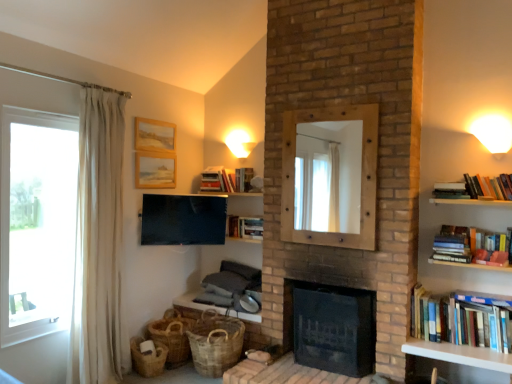
Question: Considering the relative sizes of wooden picture frame at upper center, the first picture frame ordered from the bottom, and wooden picture frame at upper center, the second picture frame ordered from the bottom, in the image provided, is wooden picture frame at upper center, the first picture frame ordered from the bottom, taller than wooden picture frame at upper center, the second picture frame ordered from the bottom,?

Choices:
 (A) no
 (B) yes

Answer: (B)

Question: Is wooden picture frame at upper center, acting as the second picture frame starting from the top, in front of wooden picture frame at upper center, which is the first picture frame from top to bottom?

Choices:
 (A) no
 (B) yes

Answer: (A)

Question: Would you say wooden picture frame at upper center, which is the first picture frame from top to bottom, is part of wooden picture frame at upper center, acting as the second picture frame starting from the top,'s contents?

Choices:
 (A) yes
 (B) no

Answer: (B)

Question: From a real-world perspective, is wooden picture frame at upper center, the first picture frame ordered from the bottom, located beneath wooden picture frame at upper center, which is the first picture frame from top to bottom?

Choices:
 (A) no
 (B) yes

Answer: (B)

Question: Are wooden picture frame at upper center, acting as the second picture frame starting from the top, and wooden picture frame at upper center, the second picture frame ordered from the bottom, located far from each other?

Choices:
 (A) yes
 (B) no

Answer: (B)

Question: From the image's perspective, is wooden picture frame at upper center, acting as the second picture frame starting from the top, located beneath wooden picture frame at upper center, which is the first picture frame from top to bottom?

Choices:
 (A) yes
 (B) no

Answer: (A)

Question: Is hardcover books at upper center, which is counted as the 1th book, starting from the top, thinner than hardcover books at right, marked as the second book in a front-to-back arrangement?

Choices:
 (A) no
 (B) yes

Answer: (A)

Question: Is hardcover books at upper center, the 1th book in the back-to-front sequence, closer to the viewer compared to hardcover books at right, arranged as the fourth book when viewed from the back?

Choices:
 (A) yes
 (B) no

Answer: (B)

Question: Can you confirm if hardcover books at upper center, which is counted as the 1th book, starting from the top, is positioned to the right of hardcover books at right, placed as the fourth book when sorted from bottom to top?

Choices:
 (A) yes
 (B) no

Answer: (B)

Question: Considering the relative positions of hardcover books at upper center, the 5th book when ordered from right to left, and hardcover books at right, positioned as the 5th book in left-to-right order, in the image provided, is hardcover books at upper center, the 5th book when ordered from right to left, to the left of hardcover books at right, positioned as the 5th book in left-to-right order, from the viewer's perspective?

Choices:
 (A) yes
 (B) no

Answer: (A)

Question: From the image's perspective, would you say hardcover books at upper center, which appears as the fifth book when viewed from the front, is positioned over hardcover books at right, positioned as the 5th book in left-to-right order?

Choices:
 (A) yes
 (B) no

Answer: (A)

Question: Could you tell me if hardcover books at upper center, which appears as the 1th book when viewed from the left, is facing hardcover books at right, acting as the first book starting from the right?

Choices:
 (A) yes
 (B) no

Answer: (B)

Question: From the image's perspective, would you say white sheer curtain at left is positioned over brown woven basket at lower left, marked as the 3th basket in a right-to-left arrangement?

Choices:
 (A) yes
 (B) no

Answer: (A)